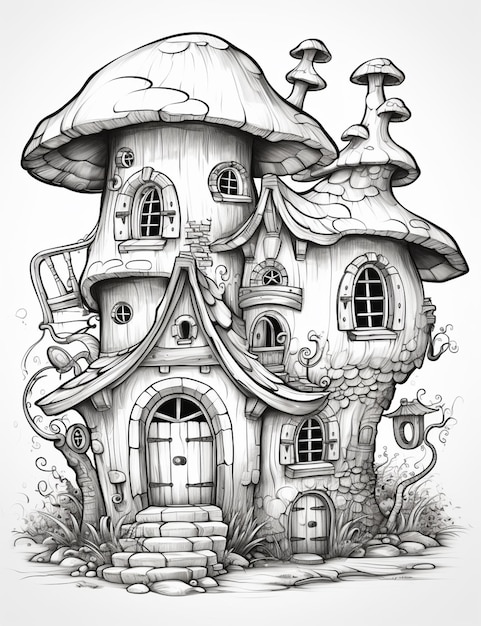
Locate an element on the screen. The height and width of the screenshot is (626, 481). windows is located at coordinates (229, 180), (147, 218), (121, 312), (271, 274), (378, 293), (128, 155).